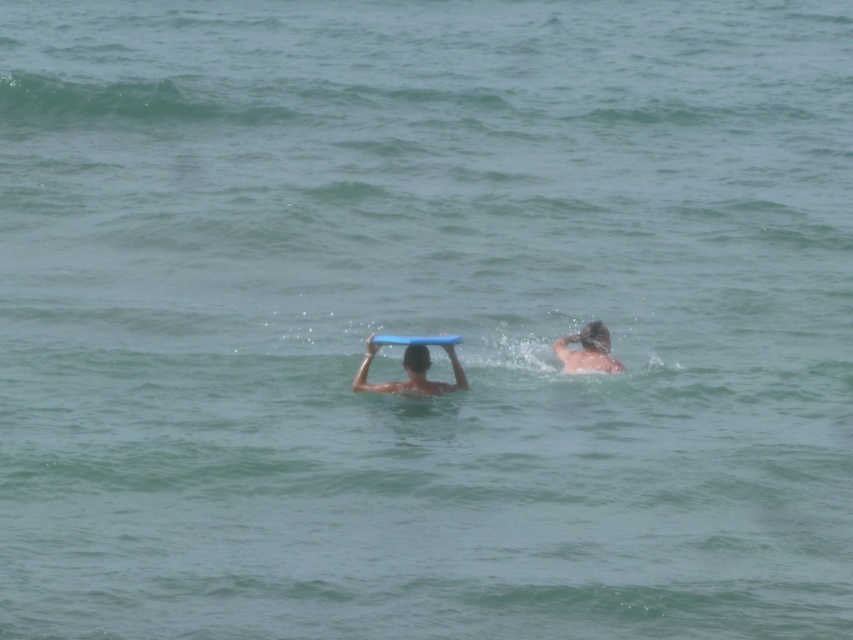
Question: Does smooth skin head at upper center have a greater width compared to blue foam surfboard at center?

Choices:
 (A) no
 (B) yes

Answer: (A)

Question: Does blue matte surfboard at center appear on the right side of blue foam surfboard at center?

Choices:
 (A) yes
 (B) no

Answer: (B)

Question: Which of the following is the closest to the observer?

Choices:
 (A) (440, 337)
 (B) (369, 349)
 (C) (590, 346)

Answer: (A)

Question: Can you confirm if blue matte surfboard at center is wider than smooth skin head at upper center?

Choices:
 (A) no
 (B) yes

Answer: (B)

Question: Which point is farther from the camera taking this photo?

Choices:
 (A) (373, 346)
 (B) (372, 337)
 (C) (602, 342)

Answer: (C)

Question: Among these objects, which one is nearest to the camera?

Choices:
 (A) smooth skin head at upper center
 (B) blue foam surfboard at center
 (C) blue matte surfboard at center

Answer: (B)